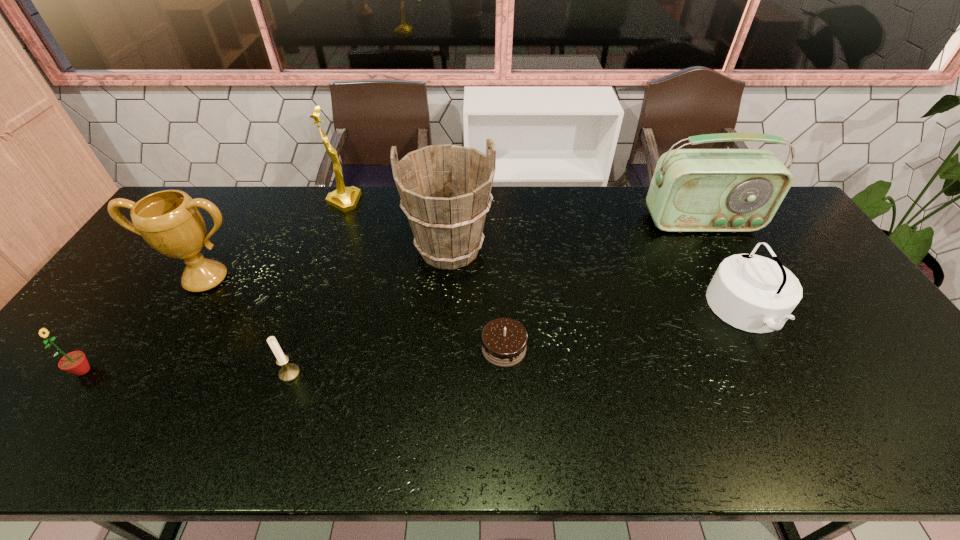
Identify the location of vacant area at the right edge of the desktop. (774, 244).

Identify the location of empty space between the shorter award and the kettle. The image size is (960, 540). (477, 295).

This screenshot has width=960, height=540. In order to click on free space between the shortest object and the bucket in this screenshot , I will do `click(477, 299)`.

Image resolution: width=960 pixels, height=540 pixels. In order to click on free area in between the radio receiver and the shortest object in this screenshot , I will do `click(603, 285)`.

The height and width of the screenshot is (540, 960). What are the coordinates of `vacant space that is in between the second object from left to right and the bucket` in the screenshot? It's located at (328, 264).

Where is `blank region between the candle holder and the leftmost object`? blank region between the candle holder and the leftmost object is located at coordinates (186, 372).

This screenshot has height=540, width=960. I want to click on empty space that is in between the farther award and the chocolate cake, so [x=423, y=275].

Locate an element on the screen. Image resolution: width=960 pixels, height=540 pixels. free space between the candle holder and the farther award is located at coordinates (317, 288).

The image size is (960, 540). Identify the location of free point between the second object from left to right and the sunflower. (145, 325).

Find the location of `free spot between the candle holder and the shortest object`. free spot between the candle holder and the shortest object is located at coordinates (396, 361).